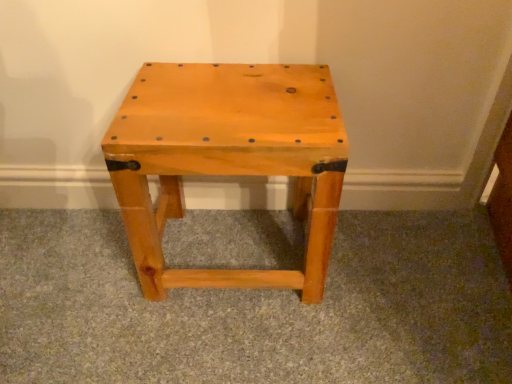
What are the coordinates of `vacant space situated on the left part of natural wood stool at center` in the screenshot? It's located at (72, 274).